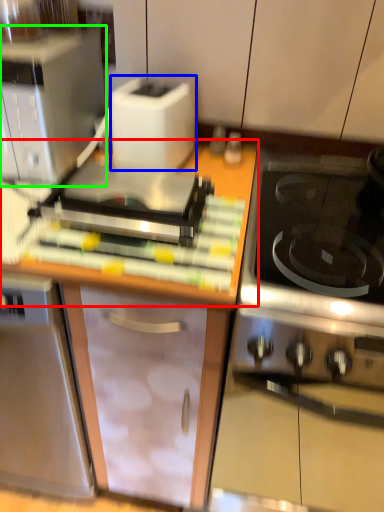
Question: Which object is positioned farthest from countertop (highlighted by a red box)? Select from toaster (highlighted by a blue box) and kitchen appliance (highlighted by a green box).

Choices:
 (A) toaster
 (B) kitchen appliance

Answer: (B)